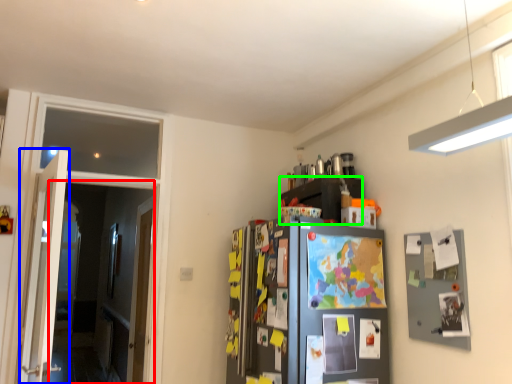
Question: Which is farther away from glass door (highlighted by a red box)? door (highlighted by a blue box) or cabinetry (highlighted by a green box)?

Choices:
 (A) door
 (B) cabinetry

Answer: (B)